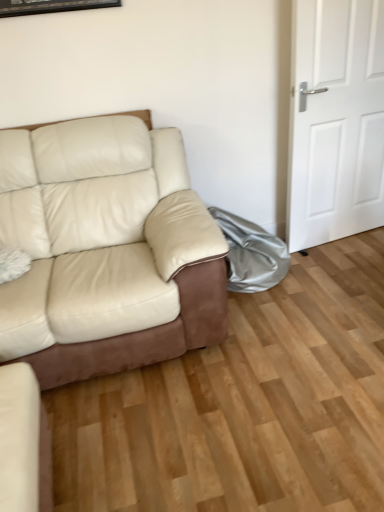
You are a GUI agent. You are given a task and a screenshot of the screen. Output one action in this format:
    pyautogui.click(x=<x>, y=<y>)
    Task: Click on the vacant space to the right of beige leather couch at left, marked as the first studio couch in a top-to-bottom arrangement
    The height and width of the screenshot is (512, 384).
    Given the screenshot: What is the action you would take?
    pyautogui.click(x=299, y=339)